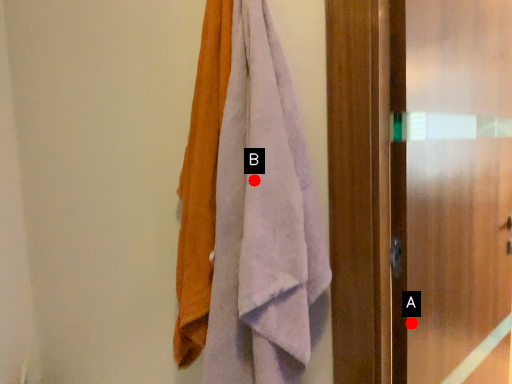
Question: Two points are circled on the image, labeled by A and B beside each circle. Which of the following is the farthest from the observer?

Choices:
 (A) A is further
 (B) B is further

Answer: (A)